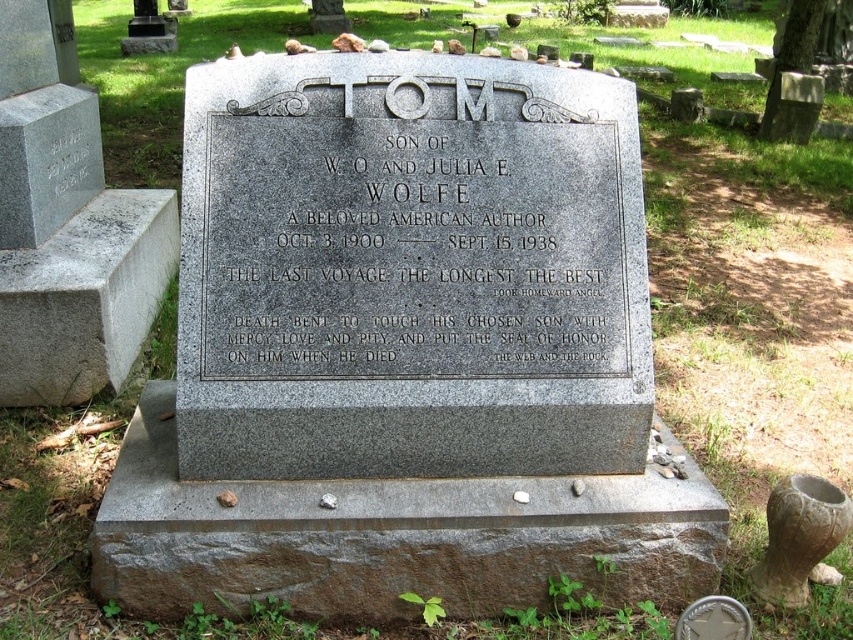
Question: Which point is closer to the camera?

Choices:
 (A) (476, 298)
 (B) (254, 230)
 (C) (165, 51)

Answer: (B)

Question: Does gray granite plaque at center have a lesser width compared to brushed metal urn at upper left?

Choices:
 (A) no
 (B) yes

Answer: (A)

Question: Based on their relative distances, which object is farther from the black granite plaque at center?

Choices:
 (A) gray granite gravestone at center
 (B) carved stone vase at lower right
 (C) brushed metal urn at upper left

Answer: (C)

Question: Can you confirm if carved stone vase at lower right is thinner than brushed metal urn at upper left?

Choices:
 (A) no
 (B) yes

Answer: (B)

Question: Which point is closer to the camera?

Choices:
 (A) (267, 97)
 (B) (32, 58)

Answer: (A)

Question: Is black granite plaque at center bigger than granite gravestone at center?

Choices:
 (A) yes
 (B) no

Answer: (B)